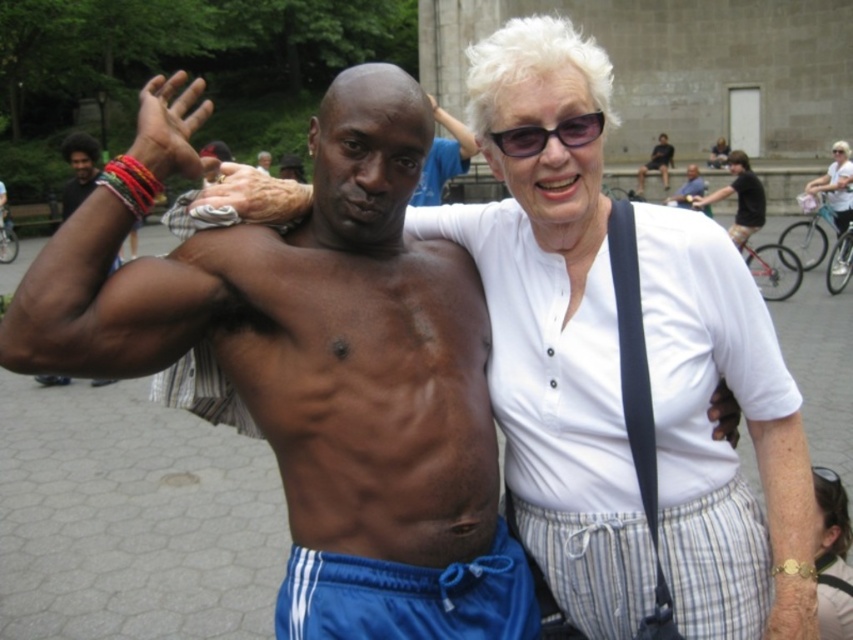
Based on the scene description, which object is positioned lower on the image between the smooth skin torso at center and the dark brown skin at center?

The smooth skin torso at center is located below dark brown skin at center, so it is positioned lower in the image.

You are a photographer trying to capture a photo of the black plastic sunglasses at upper center and the blue fabric shorts at lower center. Which object is positioned lower in the frame?

The blue fabric shorts at lower center is positioned lower in the frame than the black plastic sunglasses at upper center.